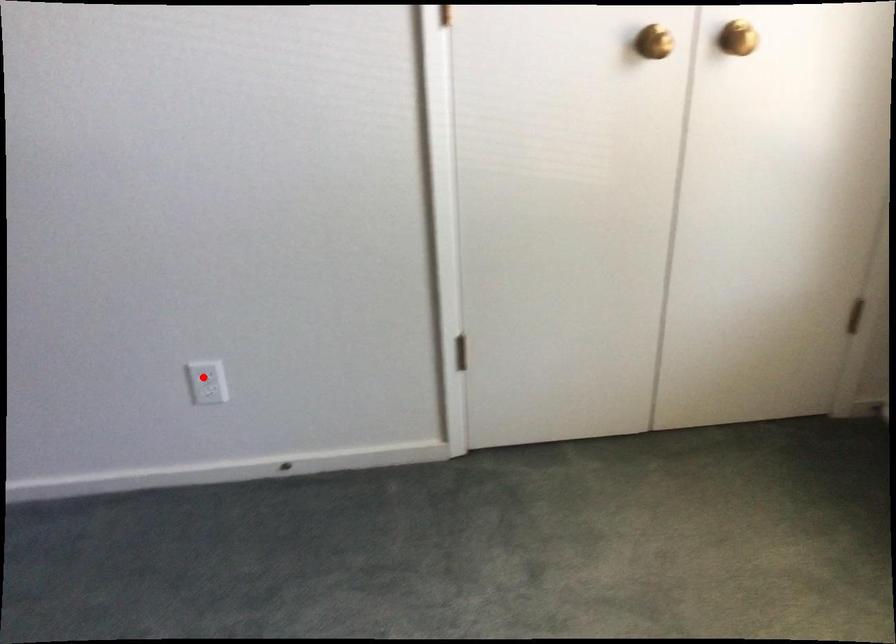
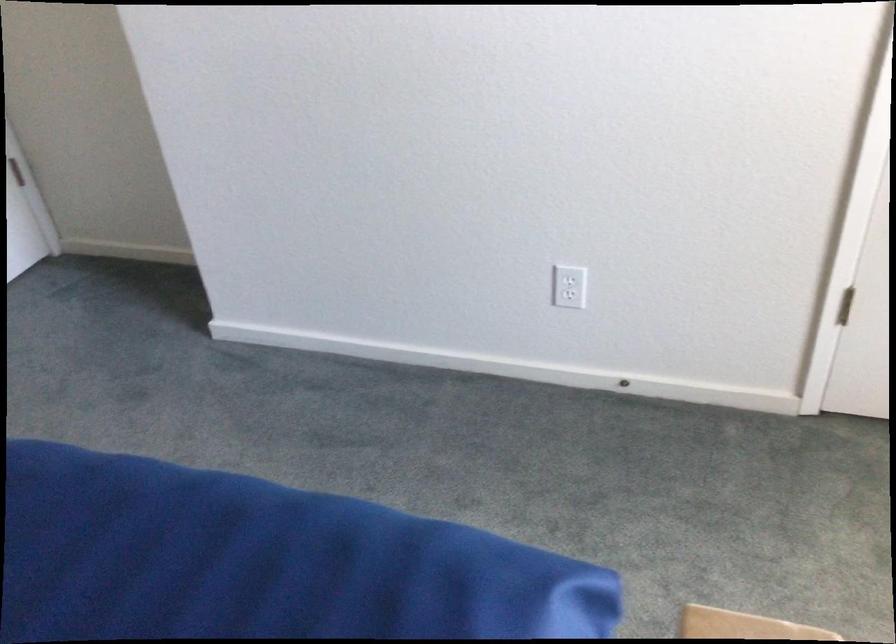
Locate, in the second image, the point that corresponds to the highlighted location in the first image.

(570, 279)